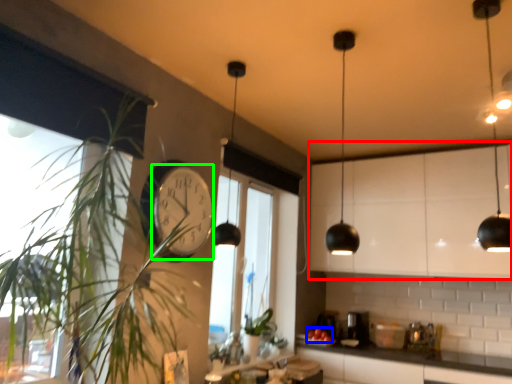
Question: Based on their relative distances, which object is farther from cabinetry (highlighted by a red box)? Choose from fruit (highlighted by a blue box) and clock (highlighted by a green box).

Choices:
 (A) fruit
 (B) clock

Answer: (B)